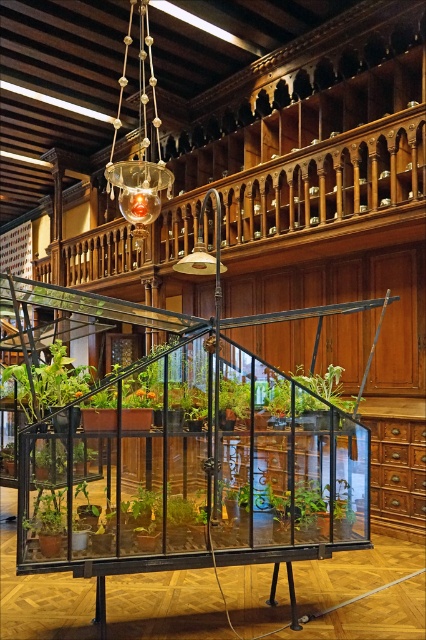
You are a gardener who needs to place a new plant exactly at the center of the greenhouse. The greenhouse is a rectangular structure. Given that the green leafy plant at center is already placed at point 0.603, 0.765, can you determine if this plant is correctly positioned at the center of the greenhouse?

The green leafy plant at center is placed at point (325, 385). Since the coordinates are given as the center point, this indicates that the plant is indeed positioned correctly at the center of the greenhouse.

You are standing in the library and see the point at coordinates (138, 144). What object is this point located on?

The point at coordinates (138, 144) is located on the translucent glass chandelier at upper center.

You are a visitor in the library and want to take a closer look at both the green leafy plant at center and the green matte plant at lower left. Which plant should you approach first to reach the one closer to you?

You should approach the green leafy plant at center first because it is closer to you than the green matte plant at lower left.